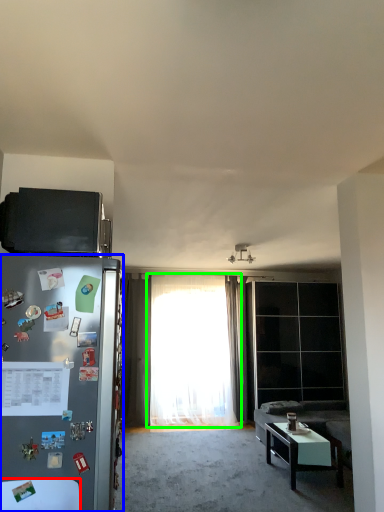
Question: Which is farther away from table (highlighted by a red box)? refrigerator (highlighted by a blue box) or curtain (highlighted by a green box)?

Choices:
 (A) refrigerator
 (B) curtain

Answer: (B)